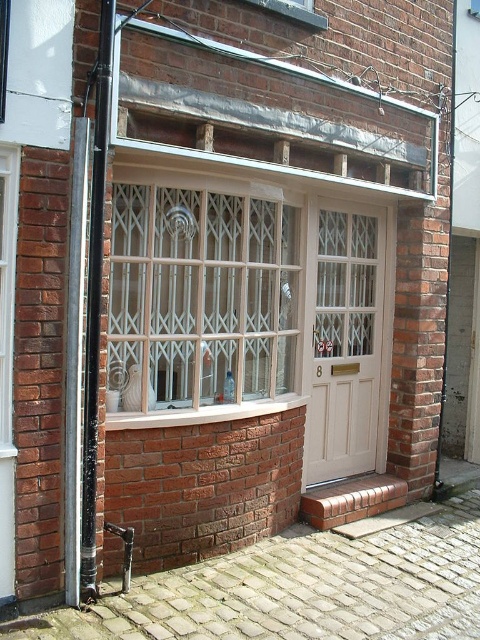
You are a delivery person trying to deliver a package to apartment 8. You see a clear glass window at center and a white wooden door at center. Which one is the correct entrance to use for the delivery?

The white wooden door at center is the correct entrance for the delivery since it is labeled with the number 8, while the clear glass window at center is likely part of the building structure and not an entrance.